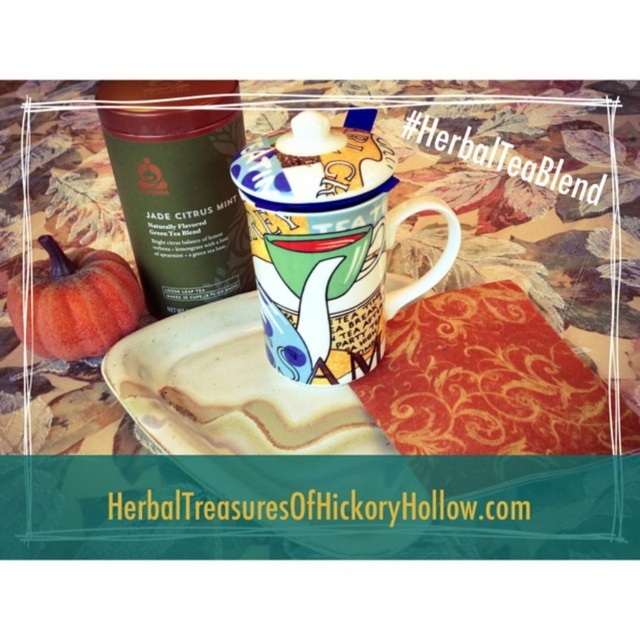
Question: Which object is positioned closest to the orange matte pumpkin at lower left?

Choices:
 (A) green matte tin at upper left
 (B) porcelain mug with colorful design at center
 (C) matte ceramic plate at center

Answer: (A)

Question: Can you confirm if matte ceramic plate at center is positioned to the left of porcelain mug with colorful design at center?

Choices:
 (A) no
 (B) yes

Answer: (A)

Question: Is matte ceramic plate at center below orange matte pumpkin at lower left?

Choices:
 (A) yes
 (B) no

Answer: (A)

Question: Estimate the real-world distances between objects in this image. Which object is closer to the green matte tin at upper left?

Choices:
 (A) porcelain mug with colorful design at center
 (B) matte ceramic plate at center
 (C) orange matte pumpkin at lower left

Answer: (C)

Question: Can you confirm if matte ceramic plate at center is positioned to the right of porcelain mug with colorful design at center?

Choices:
 (A) yes
 (B) no

Answer: (A)

Question: Which object appears closest to the camera in this image?

Choices:
 (A) orange matte pumpkin at lower left
 (B) porcelain mug with colorful design at center
 (C) green matte tin at upper left

Answer: (B)